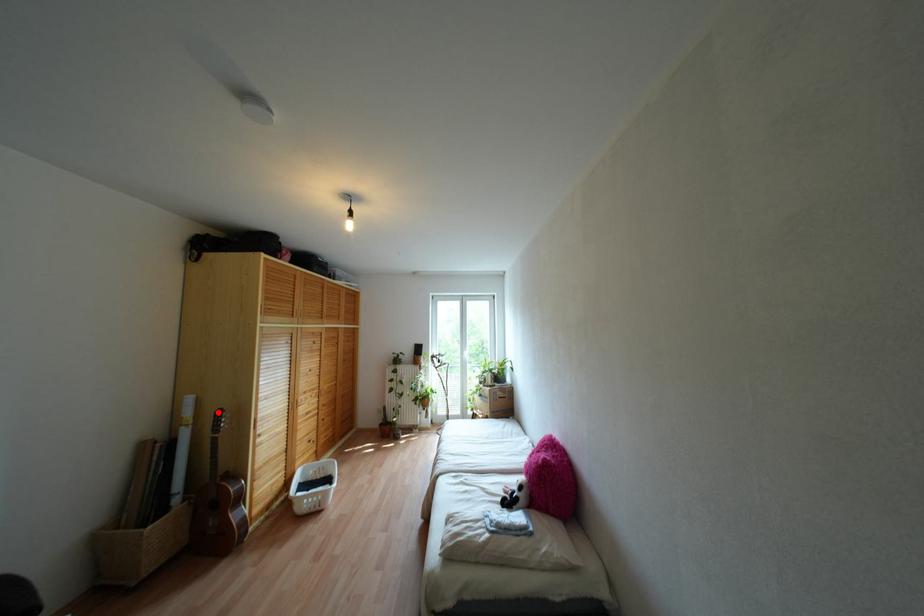
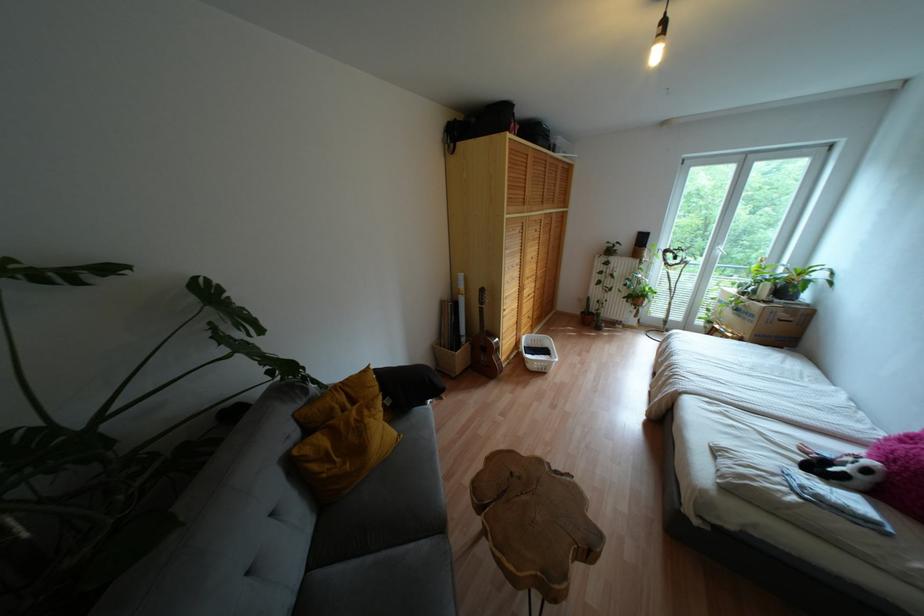
Find the pixel in the second image that matches the highlighted location in the first image.

(481, 290)